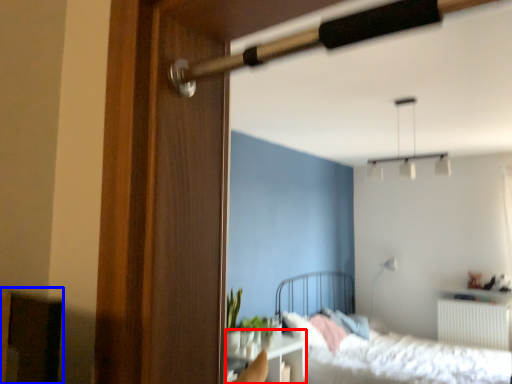
Question: Among these objects, which one is nearest to the camera, table (highlighted by a red box) or furniture (highlighted by a blue box)?

Choices:
 (A) table
 (B) furniture

Answer: (B)